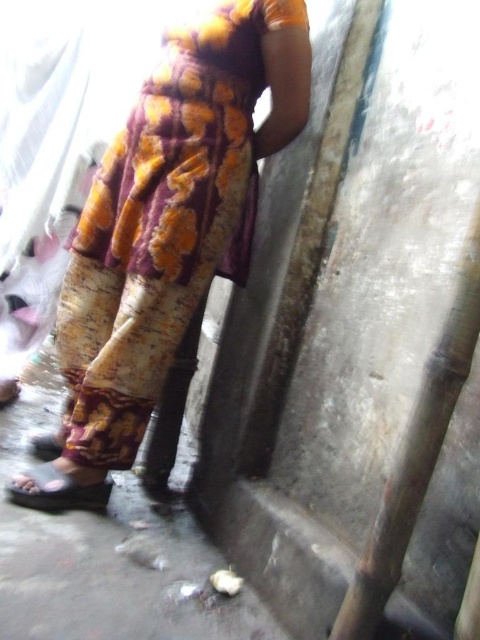
Which is in front, point (247, 186) or point (70, 508)?

Point (70, 508) is more forward.

Is printed fabric dress at center above matte black sandal at lower left?

Yes.

Does point (171, 150) come behind point (69, 490)?

No, it is not.

Where is `printed fabric dress at center`? The image size is (480, 640). printed fabric dress at center is located at coordinates (170, 218).